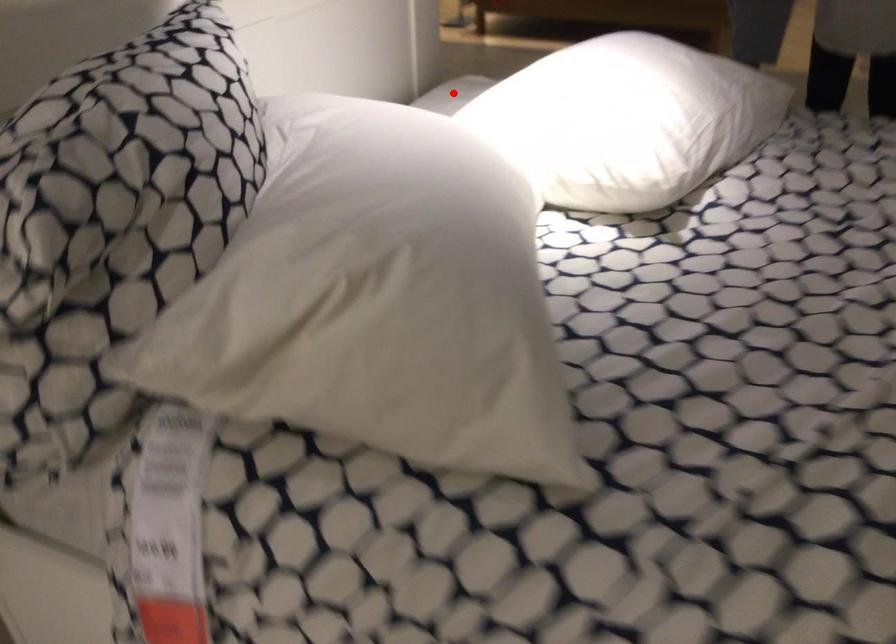
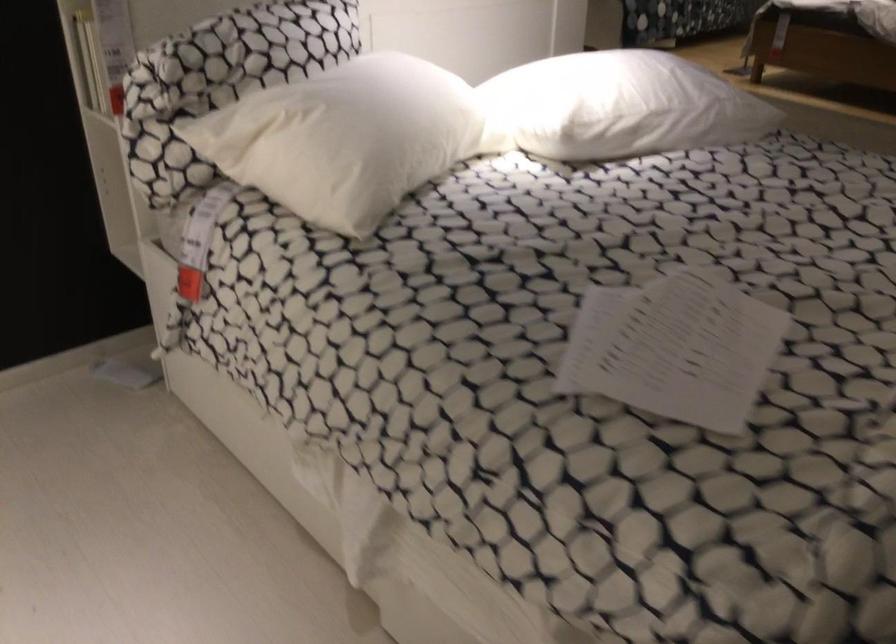
Question: I am providing you with two images of the same scene from different viewpoints. A red point is marked on the first image. At the location where the point appears in image 1, is it still visible in image 2?

Choices:
 (A) Yes
 (B) No

Answer: (B)